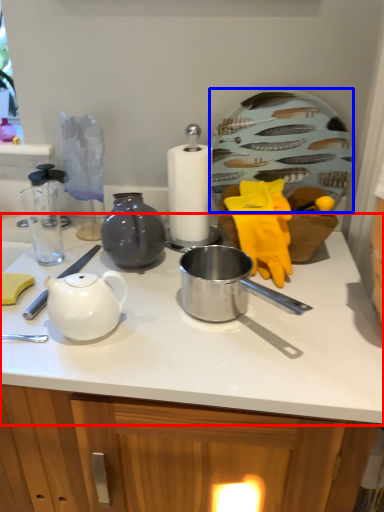
Question: Which object appears farthest to the camera in this image, countertop (highlighted by a red box) or plate (highlighted by a blue box)?

Choices:
 (A) countertop
 (B) plate

Answer: (B)